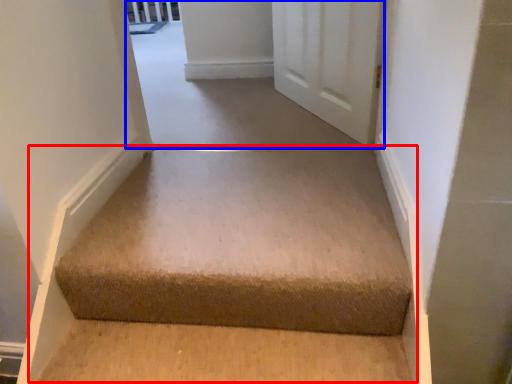
Question: Which point is closer to the camera, stairwell (highlighted by a red box) or passage (highlighted by a blue box)?

Choices:
 (A) stairwell
 (B) passage

Answer: (A)